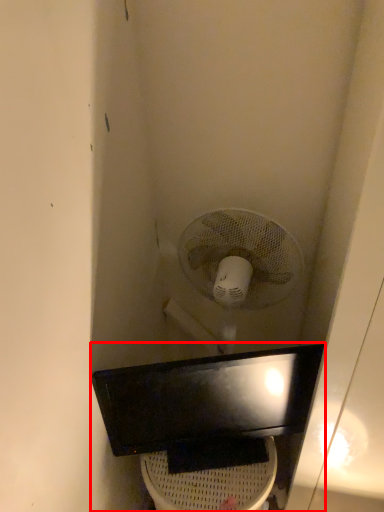
Question: From the image's perspective, what is the correct spatial relationship of sink (annotated by the red box) in relation to toilet bowl?

Choices:
 (A) above
 (B) below

Answer: (A)